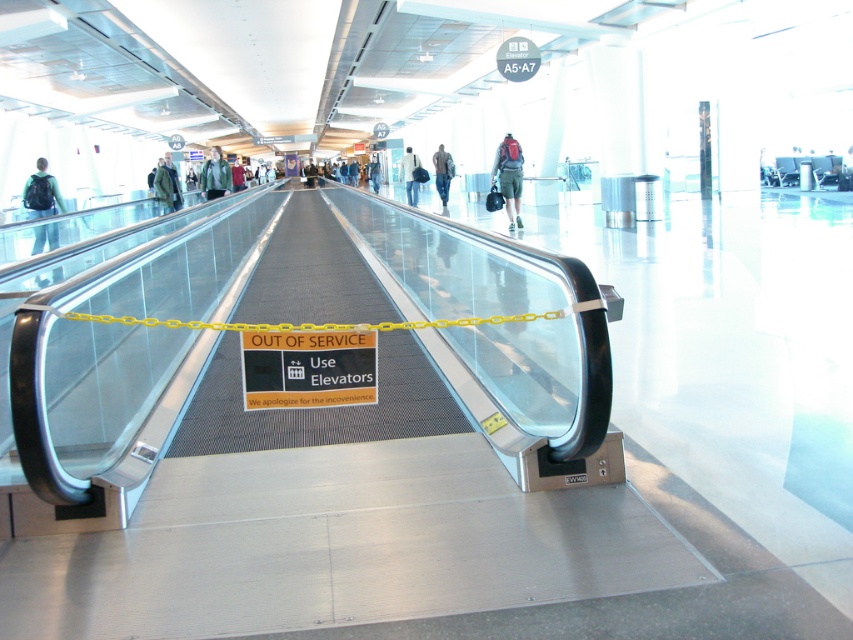
Question: Which object is the farthest from the green wool coat at center?

Choices:
 (A) matte black backpack at left
 (B) green matte jacket at center
 (C) denim pants at center
 (D) light blue jeans at center

Answer: (D)

Question: Is light blue jeans at center smaller than dark gray backpack at center?

Choices:
 (A) yes
 (B) no

Answer: (B)

Question: Can you confirm if green matte jacket at center is positioned below denim pants at center?

Choices:
 (A) no
 (B) yes

Answer: (A)

Question: Which object is positioned farthest from the green wool coat at center?

Choices:
 (A) denim pants at center
 (B) matte black backpack at left
 (C) red backpack at center
 (D) light blue jeans at center

Answer: (C)

Question: Which of the following is the farthest from the observer?

Choices:
 (A) (509, 212)
 (B) (171, 176)

Answer: (B)

Question: Is matte black backpack at left positioned before dark gray backpack at center?

Choices:
 (A) no
 (B) yes

Answer: (B)